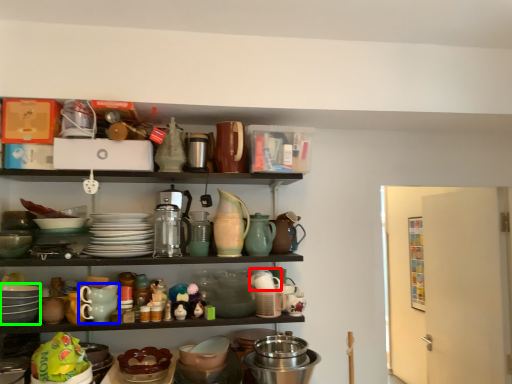
Question: Based on their relative distances, which object is nearer to tableware (highlighted by a red box)? Choose from tableware (highlighted by a blue box) and tableware (highlighted by a green box).

Choices:
 (A) tableware
 (B) tableware

Answer: (A)